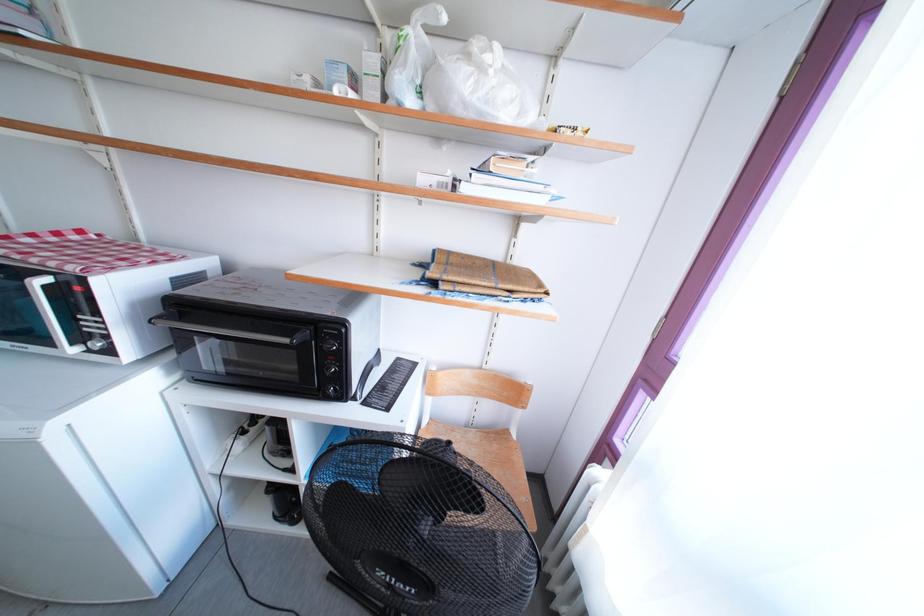
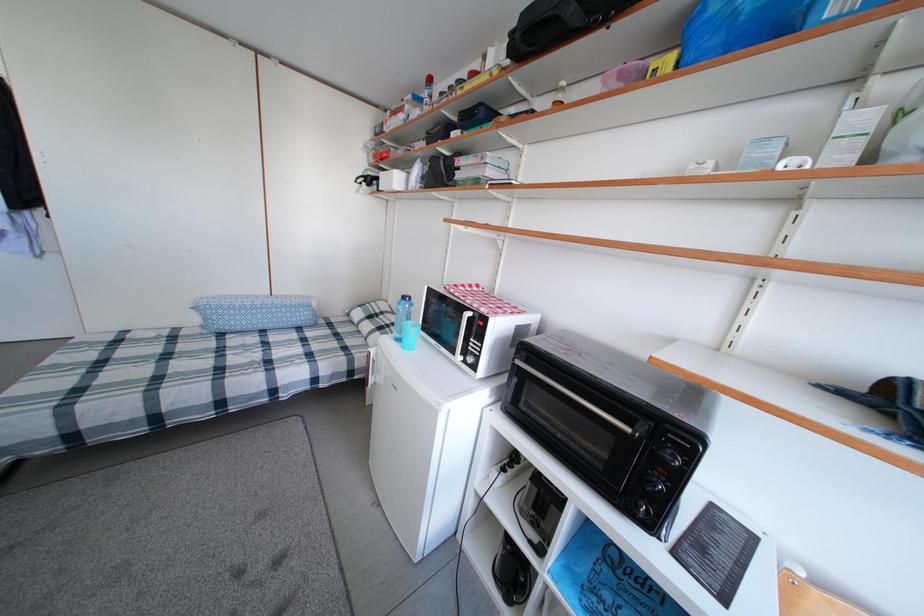
Question: The camera is either moving clockwise (left) or counter-clockwise (right) around the object. The first image is from the beginning of the video and the second image is from the end. Is the camera moving left or right when shooting the video?

Choices:
 (A) Left
 (B) Right

Answer: (B)